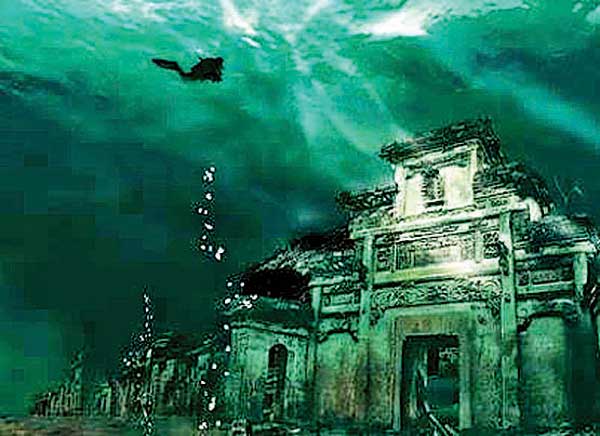
Where is `column`? Image resolution: width=600 pixels, height=436 pixels. column is located at coordinates (307, 347), (361, 348), (508, 353), (580, 277), (463, 388), (396, 377), (294, 379), (250, 367).